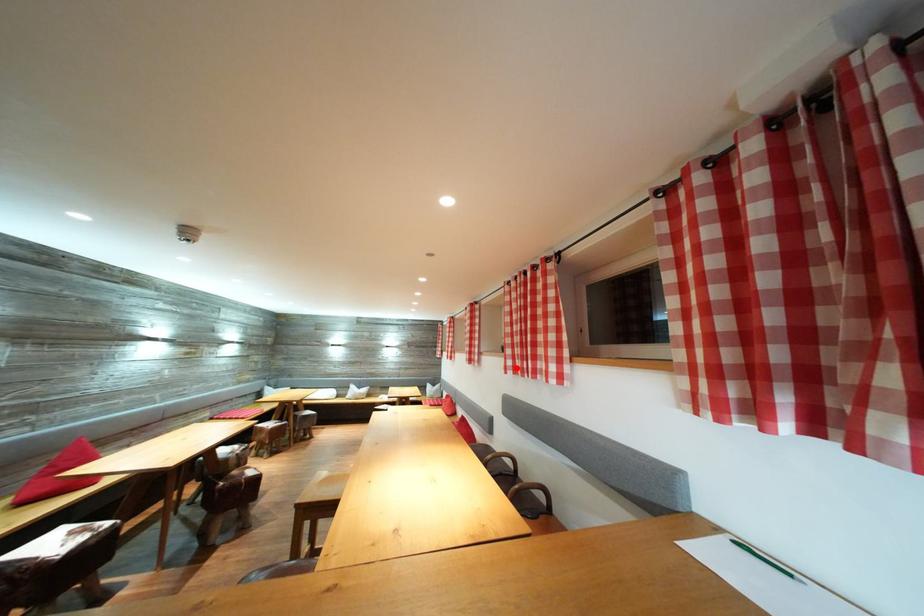
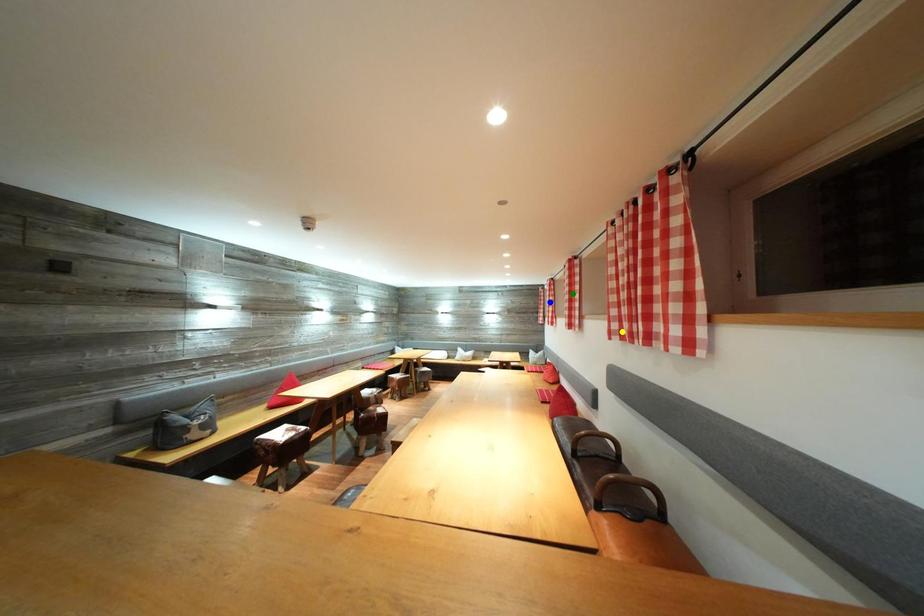
Question: I am providing you with two images of the same scene from different viewpoints. A red point is marked on the first image. You are given multiple points on the second image. Which spot in image 2 lines up with the point in image 1?

Choices:
 (A) blue point
 (B) yellow point
 (C) green point

Answer: (B)